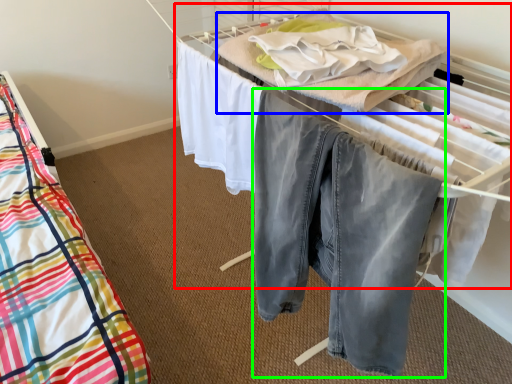
Question: Which is farther away from bed (highlighted by a red box)? blanket (highlighted by a blue box) or trousers (highlighted by a green box)?

Choices:
 (A) blanket
 (B) trousers

Answer: (B)